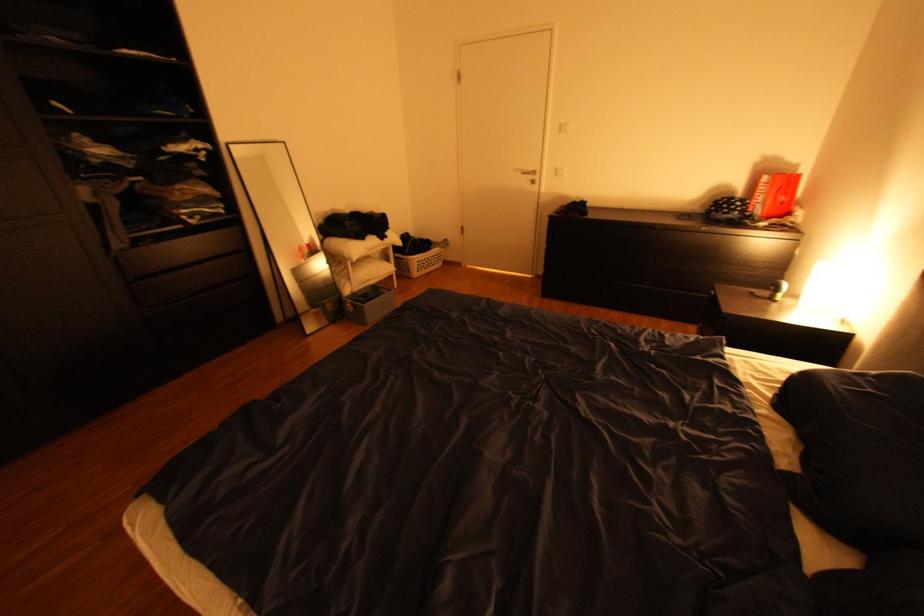
Locate an element on the screen. laundry basket is located at coordinates (418, 256).